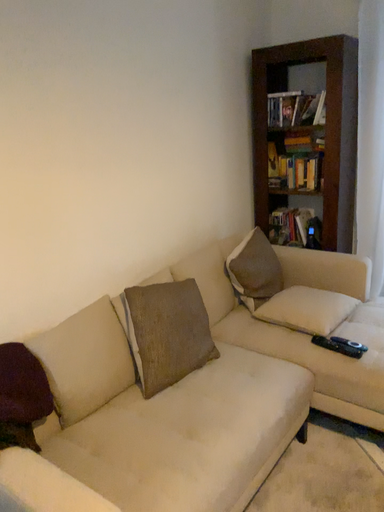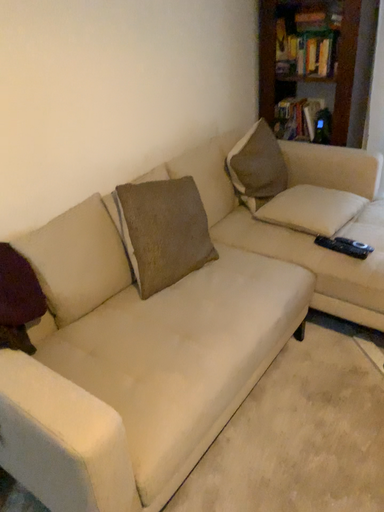
Question: Which way did the camera rotate in the video?

Choices:
 (A) rotated downward
 (B) rotated upward

Answer: (A)